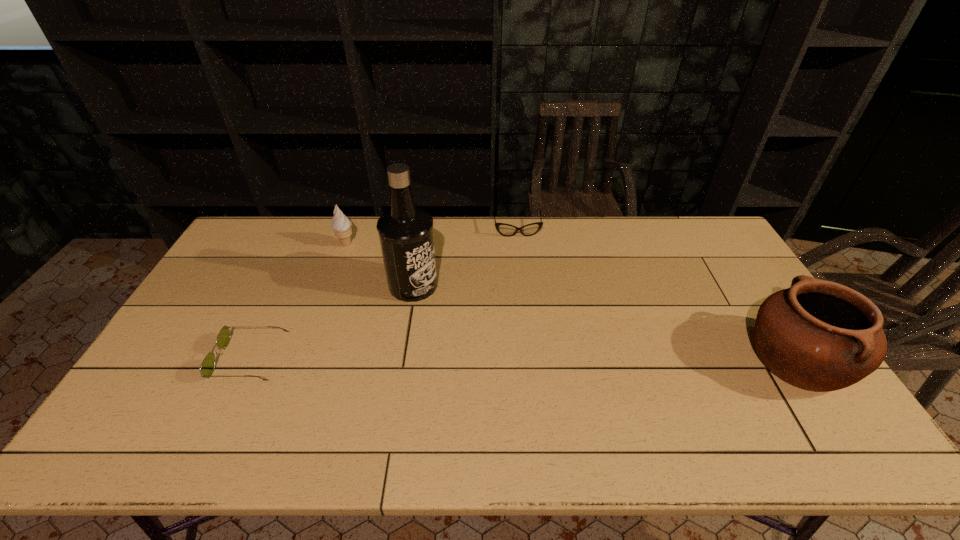
Locate an element on the screen. The height and width of the screenshot is (540, 960). vacant space on the desktop that is between the leftmost object and the rightmost object and is positioned on the front label of the third farthest object is located at coordinates (587, 359).

Identify the location of vacant spot on the desktop that is between the sunglasses and the second tallest object and is positioned on the front-facing side of the fourth nearest object. (448, 359).

Locate an element on the screen. This screenshot has width=960, height=540. free space on the desktop that is between the sunglasses and the rightmost object and is positioned on the front-facing side of the farthest object is located at coordinates (537, 359).